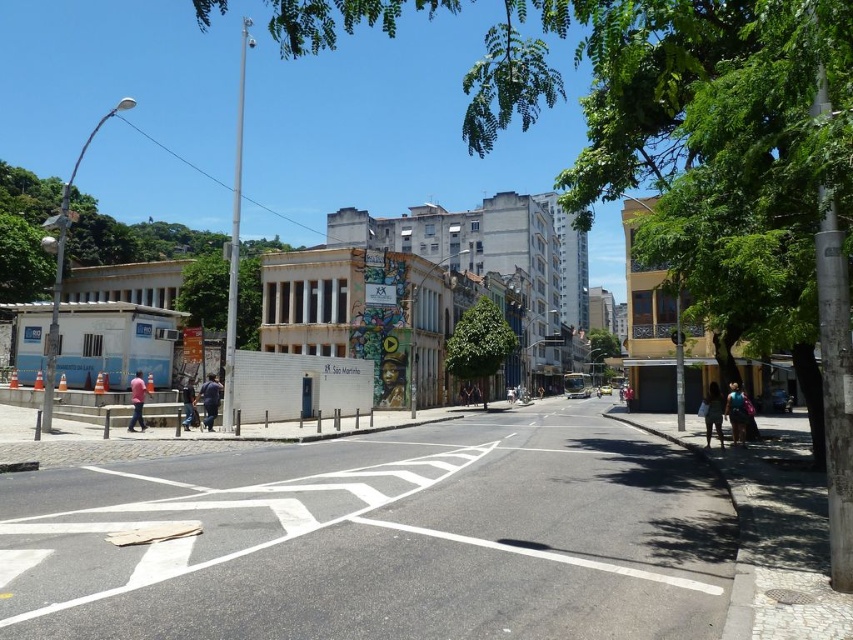
Which is behind, point (212, 408) or point (193, 413)?

Positioned behind is point (193, 413).

Which is behind, point (215, 380) or point (192, 392)?

The point (215, 380) is more distant.

The image size is (853, 640). Find the location of `dark blue fabric at center`. dark blue fabric at center is located at coordinates (210, 401).

Can you confirm if dark blue jeans at lower center is positioned above red leather jacket at center?

Yes, dark blue jeans at lower center is above red leather jacket at center.

What do you see at coordinates (187, 403) in the screenshot?
I see `dark blue jeans at lower center` at bounding box center [187, 403].

The height and width of the screenshot is (640, 853). Find the location of `dark blue jeans at lower center`. dark blue jeans at lower center is located at coordinates (187, 403).

Is dark blue jeans at lower right positioned before pink fabric shirt at lower left?

Yes.

What do you see at coordinates (712, 413) in the screenshot?
I see `dark blue jeans at lower right` at bounding box center [712, 413].

Is point (714, 401) more distant than point (136, 397)?

No, it is not.

What are the coordinates of `dark blue jeans at lower right` in the screenshot? It's located at (712, 413).